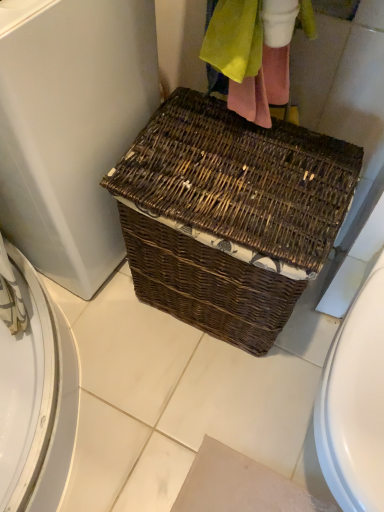
Measure the distance between point (233, 225) and camera.

The distance of point (233, 225) from camera is 29.49 inches.

What are the coordinates of `brown wicker basket at center` in the screenshot? It's located at (229, 215).

Describe the element at coordinates (229, 215) in the screenshot. The width and height of the screenshot is (384, 512). I see `brown wicker basket at center` at that location.

What do you see at coordinates (71, 127) in the screenshot? The height and width of the screenshot is (512, 384). I see `brown wicker basket at center` at bounding box center [71, 127].

Image resolution: width=384 pixels, height=512 pixels. Identify the location of brown wicker basket at center. (71, 127).

Image resolution: width=384 pixels, height=512 pixels. I want to click on brown wicker basket at center, so click(x=229, y=215).

Considering the positions of objects brown wicker basket at center and brown wicker basket at center in the image provided, who is more to the left, brown wicker basket at center or brown wicker basket at center?

brown wicker basket at center.

Is the position of brown wicker basket at center less distant than that of brown wicker basket at center?

Yes.

Is point (64, 196) closer or farther from the camera than point (232, 268)?

Point (64, 196) is positioned farther from the camera compared to point (232, 268).

Looking at this image, from the image's perspective, which one is positioned lower, brown wicker basket at center or brown wicker basket at center?

brown wicker basket at center appears lower in the image.

From a real-world perspective, which object stands above the other?

brown wicker basket at center, from a real-world perspective.

Considering the sizes of brown wicker basket at center and brown wicker basket at center in the image, is brown wicker basket at center wider or thinner than brown wicker basket at center?

In the image, brown wicker basket at center appears to be wider than brown wicker basket at center.

From their relative heights in the image, would you say brown wicker basket at center is taller or shorter than brown wicker basket at center?

Considering their sizes, brown wicker basket at center has more height than brown wicker basket at center.

Looking at the image, does brown wicker basket at center seem bigger or smaller compared to brown wicker basket at center?

Clearly, brown wicker basket at center is larger in size than brown wicker basket at center.

Would you say brown wicker basket at center is inside or outside brown wicker basket at center?

brown wicker basket at center is outside brown wicker basket at center.

Based on the photo, is brown wicker basket at center not close to brown wicker basket at center?

No, there isn't a large distance between brown wicker basket at center and brown wicker basket at center.

Is brown wicker basket at center facing towards brown wicker basket at center?

Yes, brown wicker basket at center is turned towards brown wicker basket at center.

What's the angular difference between brown wicker basket at center and brown wicker basket at center's facing directions?

They differ by 85.8 degrees in their facing directions.

Find the location of `screen door in front of the brown wicker basket at center`. screen door in front of the brown wicker basket at center is located at coordinates (71, 127).

Is brown wicker basket at center to the left of brown wicker basket at center from the viewer's perspective?

No, brown wicker basket at center is not to the left of brown wicker basket at center.

Is brown wicker basket at center closer to the viewer compared to brown wicker basket at center?

No, it is not.

Considering the points (217, 258) and (32, 195), which point is behind, point (217, 258) or point (32, 195)?

The point (32, 195) is behind.

From the image's perspective, does brown wicker basket at center appear higher than brown wicker basket at center?

No, from the image's perspective, brown wicker basket at center is not above brown wicker basket at center.

From a real-world perspective, who is located higher, brown wicker basket at center or brown wicker basket at center?

brown wicker basket at center is physically above.

Does brown wicker basket at center have a greater width compared to brown wicker basket at center?

No.

Considering the relative sizes of brown wicker basket at center and brown wicker basket at center in the image provided, is brown wicker basket at center shorter than brown wicker basket at center?

Correct, brown wicker basket at center is not as tall as brown wicker basket at center.

Who is bigger, brown wicker basket at center or brown wicker basket at center?

brown wicker basket at center is bigger.

Based on the photo, is brown wicker basket at center completely or partially inside brown wicker basket at center?

No, brown wicker basket at center is not surrounded by brown wicker basket at center.

Is there a large distance between brown wicker basket at center and brown wicker basket at center?

No, brown wicker basket at center is not far away from brown wicker basket at center.

In the scene shown: Is brown wicker basket at center oriented away from brown wicker basket at center?

No, brown wicker basket at center's orientation is not away from brown wicker basket at center.

Can you tell me how much brown wicker basket at center and brown wicker basket at center differ in facing direction?

They differ by 85.8 degrees in their facing directions.

Image resolution: width=384 pixels, height=512 pixels. Find the location of `screen door positioned vertically above the brown wicker basket at center (from a real-world perspective)`. screen door positioned vertically above the brown wicker basket at center (from a real-world perspective) is located at coordinates (71, 127).

In the image, there is a brown wicker basket at center. Identify the location of screen door above it (from the image's perspective). This screenshot has width=384, height=512. coord(71,127).

Identify the location of picnic basket on the right of brown wicker basket at center. (229, 215).